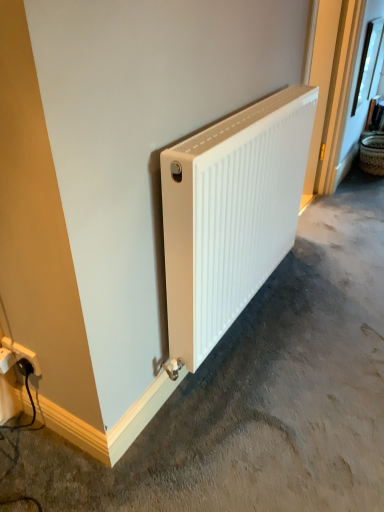
You are a GUI agent. You are given a task and a screenshot of the screen. Output one action in this format:
    pyautogui.click(x=<x>, y=<y>)
    Task: Click on the free space above white matte radiator at center (from a real-world perspective)
    The image size is (384, 512).
    Given the screenshot: What is the action you would take?
    pyautogui.click(x=235, y=114)